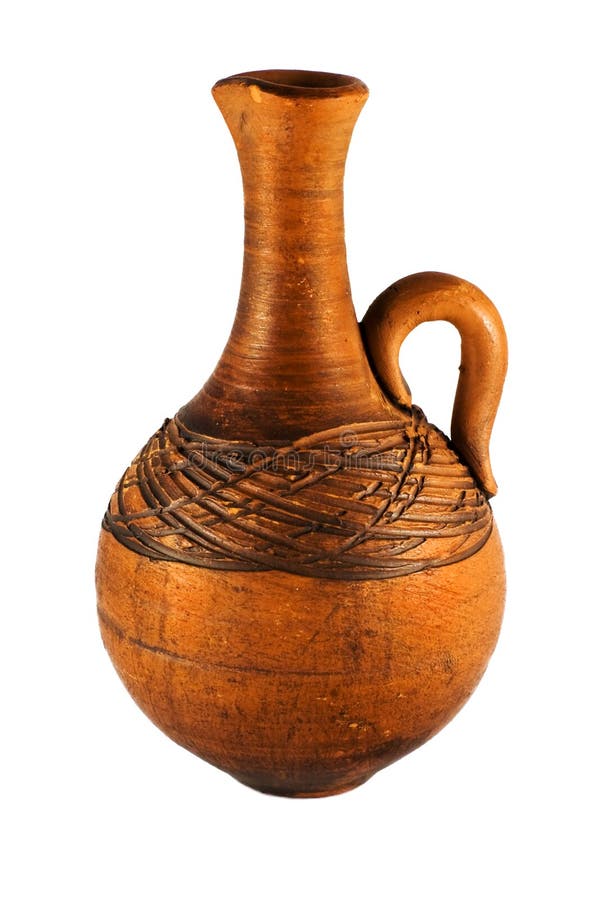
Find the location of a particular element. This screenshot has width=602, height=900. ceramic carafe is located at coordinates (288, 628).